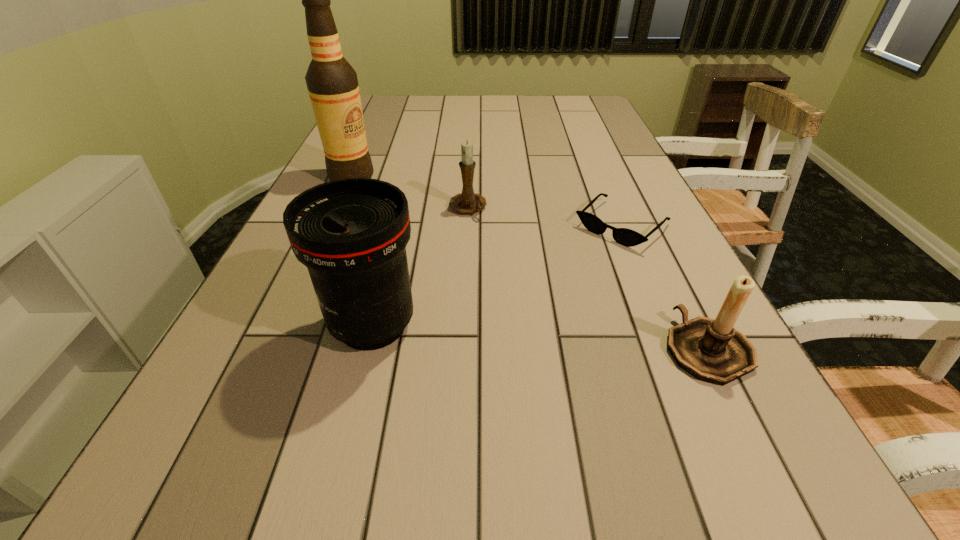
At what (x,y) coordinates should I click in order to perform the action: click on vacant region between the nearer candle holder and the left candle holder. Please return your answer as a coordinate pair (x, y). The height and width of the screenshot is (540, 960). Looking at the image, I should click on (588, 279).

Find the location of a particular element. The image size is (960, 540). vacant region between the fourth object from right to left and the nearer candle holder is located at coordinates (540, 337).

Identify the location of free space that is in between the nearer candle holder and the left candle holder. This screenshot has width=960, height=540. (588, 279).

At what (x,y) coordinates should I click in order to perform the action: click on vacant area that lies between the alcohol and the left candle holder. Please return your answer as a coordinate pair (x, y). Looking at the image, I should click on (410, 193).

The image size is (960, 540). I want to click on free space between the right candle holder and the fourth shortest object, so click(540, 337).

Locate an element on the screen. The width and height of the screenshot is (960, 540). free point between the telephoto lens and the shortest object is located at coordinates (497, 275).

The height and width of the screenshot is (540, 960). Identify the location of free space between the sunglasses and the telephoto lens. (497, 275).

Select which object is the third closest to the alcohol. Please provide its 2D coordinates. Your answer should be formatted as a tuple, i.e. [(x, y)], where the tuple contains the x and y coordinates of a point satisfying the conditions above.

[(624, 236)]

Identify which object is the third nearest to the second tallest object. Please provide its 2D coordinates. Your answer should be formatted as a tuple, i.e. [(x, y)], where the tuple contains the x and y coordinates of a point satisfying the conditions above.

[(332, 83)]

I want to click on free location that satisfies the following two spatial constraints: 1. on the front side of the right candle holder; 2. on the right side of the second tallest object, so click(367, 349).